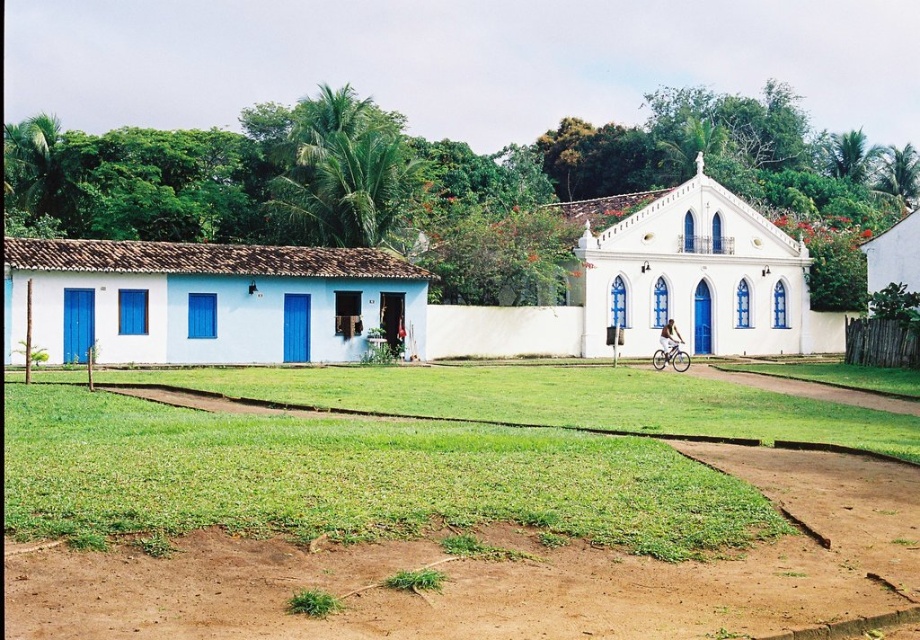
Does brown dirt track at lower center appear on the right side of white metallic bicycle at center?

Incorrect, brown dirt track at lower center is not on the right side of white metallic bicycle at center.

Does brown dirt track at lower center appear over white metallic bicycle at center?

Actually, brown dirt track at lower center is below white metallic bicycle at center.

Does point (576, 596) come closer to viewer compared to point (673, 353)?

Yes.

Locate an element on the screen. Image resolution: width=920 pixels, height=640 pixels. brown dirt track at lower center is located at coordinates click(x=509, y=576).

Can you confirm if brown dirt track at lower center is smaller than white matte/blue doors at left?

Yes.

Which is behind, point (76, 573) or point (397, 269)?

The point (397, 269) is more distant.

Find the location of `brown dirt track at lower center`. brown dirt track at lower center is located at coordinates [509, 576].

Is white matte/blue doors at left below green grass at center?

No.

Is white matte/blue doors at left above green grass at center?

Correct, white matte/blue doors at left is located above green grass at center.

Which is behind, point (108, 316) or point (790, 438)?

Positioned behind is point (108, 316).

The image size is (920, 640). Identify the location of white matte/blue doors at left. (204, 301).